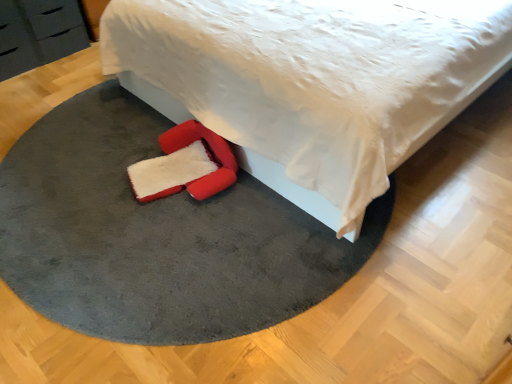
What is the approximate height of velvet gray rug at center?

The height of velvet gray rug at center is 5.80 centimeters.

Where is `velvet gray rug at center`? velvet gray rug at center is located at coordinates (156, 235).

Identify the location of matte black dresser at upper left. This screenshot has height=384, width=512. (38, 33).

What are the coordinates of `white soft bed at center` in the screenshot? It's located at (312, 82).

In the scene shown: Between velvet gray rug at center and velvet-like red footrest at lower center, which one has less height?

velvet gray rug at center is shorter.

Is velvet gray rug at center placed right next to velvet-like red footrest at lower center?

No, velvet gray rug at center is not with velvet-like red footrest at lower center.

In order to click on mat that is on the right side of velvet-like red footrest at lower center in this screenshot , I will do `click(156, 235)`.

Which object is positioned more to the left, velvet gray rug at center or velvet-like red footrest at lower center?

velvet-like red footrest at lower center is more to the left.

Looking at this image, considering the sizes of matte black dresser at upper left and velvet gray rug at center in the image, is matte black dresser at upper left bigger or smaller than velvet gray rug at center?

matte black dresser at upper left is smaller than velvet gray rug at center.

Is matte black dresser at upper left facing away from velvet gray rug at center?

No, matte black dresser at upper left is not facing the opposite direction of velvet gray rug at center.

Considering the sizes of objects matte black dresser at upper left and velvet gray rug at center in the image provided, who is taller, matte black dresser at upper left or velvet gray rug at center?

Standing taller between the two is matte black dresser at upper left.

Is velvet-like red footrest at lower center at the left side of velvet gray rug at center?

Yes, velvet-like red footrest at lower center is to the left of velvet gray rug at center.

I want to click on footwear on the left side of velvet gray rug at center, so click(x=209, y=160).

From the image's perspective, which object appears higher, velvet-like red footrest at lower center or velvet gray rug at center?

From the image's view, velvet gray rug at center is above.

Is velvet-like red footrest at lower center touching velvet gray rug at center?

There is a gap between velvet-like red footrest at lower center and velvet gray rug at center.

Which of these two, black matte drawer at upper left or velvet gray rug at center, stands taller?

Standing taller between the two is black matte drawer at upper left.

Could you tell me if black matte drawer at upper left is turned towards velvet gray rug at center?

Yes, black matte drawer at upper left is aimed at velvet gray rug at center.

Does point (15, 3) lie in front of point (29, 215)?

No, it is behind (29, 215).

Measure the distance from black matte drawer at upper left to velvet gray rug at center.

A distance of 1.44 meters exists between black matte drawer at upper left and velvet gray rug at center.

In terms of height, does black matte drawer at upper left look taller or shorter compared to velvet-like red footrest at lower center?

Considering their sizes, black matte drawer at upper left has more height than velvet-like red footrest at lower center.

Looking at this image, from a real-world perspective, is black matte drawer at upper left on top of velvet-like red footrest at lower center?

Yes.

In the scene shown: Does black matte drawer at upper left turn towards velvet-like red footrest at lower center?

Yes, black matte drawer at upper left is oriented towards velvet-like red footrest at lower center.

Are black matte drawer at upper left and velvet-like red footrest at lower center far apart?

That's right, there is a large distance between black matte drawer at upper left and velvet-like red footrest at lower center.

Does point (89, 260) lie behind point (73, 23)?

No, (89, 260) is closer to viewer.

In terms of height, does velvet gray rug at center look taller or shorter compared to matte black dresser at upper left?

velvet gray rug at center is shorter than matte black dresser at upper left.

Can matte black dresser at upper left be found inside velvet gray rug at center?

Actually, matte black dresser at upper left is outside velvet gray rug at center.

From the image's perspective, is velvet gray rug at center above or below matte black dresser at upper left?

Based on their image positions, velvet gray rug at center is located beneath matte black dresser at upper left.

Considering the positions of objects black matte drawer at upper left and white soft bed at center in the image provided, who is behind, black matte drawer at upper left or white soft bed at center?

black matte drawer at upper left is behind.

Between black matte drawer at upper left and white soft bed at center, which one has smaller size?

black matte drawer at upper left.

In the scene shown: Can you confirm if black matte drawer at upper left is positioned to the right of white soft bed at center?

No.

Is black matte drawer at upper left oriented away from white soft bed at center?

black matte drawer at upper left is not turned away from white soft bed at center.

You are a GUI agent. You are given a task and a screenshot of the screen. Output one action in this format:
    pyautogui.click(x=<x>, y=<y>)
    Task: Click on the footwear on the left of velvet gray rug at center
    
    Given the screenshot: What is the action you would take?
    pyautogui.click(x=209, y=160)

Identify the location of dresser above the velvet gray rug at center (from the image's perspective). (38, 33).

Considering their positions, is matte black dresser at upper left positioned closer to white soft bed at center than velvet-like red footrest at lower center?

Based on the image, velvet-like red footrest at lower center appears to be nearer to white soft bed at center.

Looking at the image, which one is located closer to velvet-like red footrest at lower center, white soft bed at center or velvet gray rug at center?

velvet gray rug at center lies closer to velvet-like red footrest at lower center than the other object.

Considering their positions, is white soft bed at center positioned closer to velvet gray rug at center than matte black dresser at upper left?

white soft bed at center is positioned closer to the anchor velvet gray rug at center.

Looking at the image, which one is located further to black matte drawer at upper left, velvet gray rug at center or velvet-like red footrest at lower center?

velvet-like red footrest at lower center is positioned further to the anchor black matte drawer at upper left.

When comparing their distances from velvet-like red footrest at lower center, does black matte drawer at upper left or white soft bed at center seem further?

black matte drawer at upper left lies further to velvet-like red footrest at lower center than the other object.

Looking at the image, which one is located further to white soft bed at center, black matte drawer at upper left or velvet gray rug at center?

Based on the image, black matte drawer at upper left appears to be further to white soft bed at center.

Which object lies further to the anchor point velvet gray rug at center, white soft bed at center or black matte drawer at upper left?

The object further to velvet gray rug at center is black matte drawer at upper left.

Considering their positions, is velvet gray rug at center positioned further to black matte drawer at upper left than matte black dresser at upper left?

velvet gray rug at center.

The height and width of the screenshot is (384, 512). I want to click on footwear between velvet gray rug at center and matte black dresser at upper left from front to back, so click(209, 160).

The height and width of the screenshot is (384, 512). I want to click on mat between matte black dresser at upper left and white soft bed at center from left to right, so click(156, 235).

Identify the location of dresser between black matte drawer at upper left and white soft bed at center. The width and height of the screenshot is (512, 384). (38, 33).

You are a GUI agent. You are given a task and a screenshot of the screen. Output one action in this format:
    pyautogui.click(x=<x>, y=<y>)
    Task: Click on the mat between white soft bed at center and velvet-like red footrest at lower center in the up-down direction
    This screenshot has height=384, width=512.
    Given the screenshot: What is the action you would take?
    pyautogui.click(x=156, y=235)